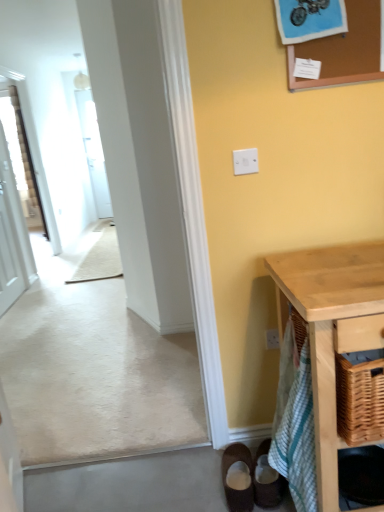
Identify the location of free space above light wood table at lower right (from a real-world perspective). This screenshot has width=384, height=512. (337, 267).